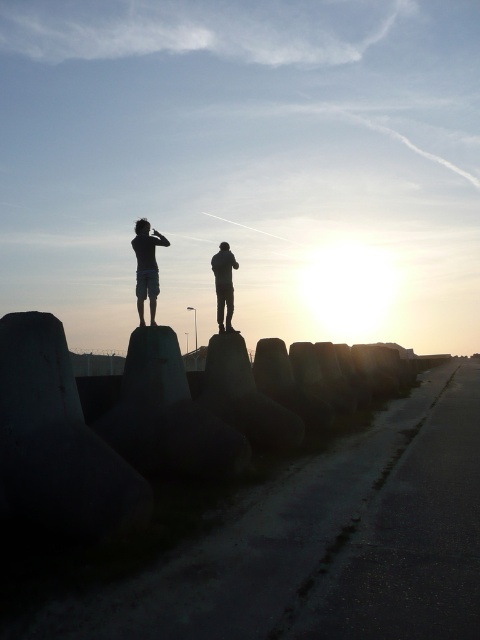
Which is below, silhouette human at center or silhouette figure at center?

silhouette figure at center

Looking at this image, between silhouette human at center and silhouette figure at center, which one has more height?

silhouette figure at center

Is point (147, 291) positioned after point (229, 280)?

No, (147, 291) is in front of (229, 280).

Where is `silhouette human at center`? silhouette human at center is located at coordinates (146, 266).

Which of these two, silhouette figures at center or silhouette human at center, stands taller?

Standing taller between the two is silhouette figures at center.

Which is in front, point (144, 252) or point (153, 256)?

Point (153, 256)

Does point (156, 292) come farther from viewer compared to point (155, 232)?

No, (156, 292) is in front of (155, 232).

This screenshot has width=480, height=640. What are the coordinates of `silhouette figures at center` in the screenshot? It's located at (146, 266).

Is point (135, 291) positioned after point (223, 284)?

That is False.

Does silhouette figures at center have a larger size compared to silhouette figure at center?

Yes.

Between point (143, 260) and point (226, 294), which one is positioned in front?

Point (143, 260) is in front.

Locate an element on the screen. silhouette figures at center is located at coordinates (146, 266).